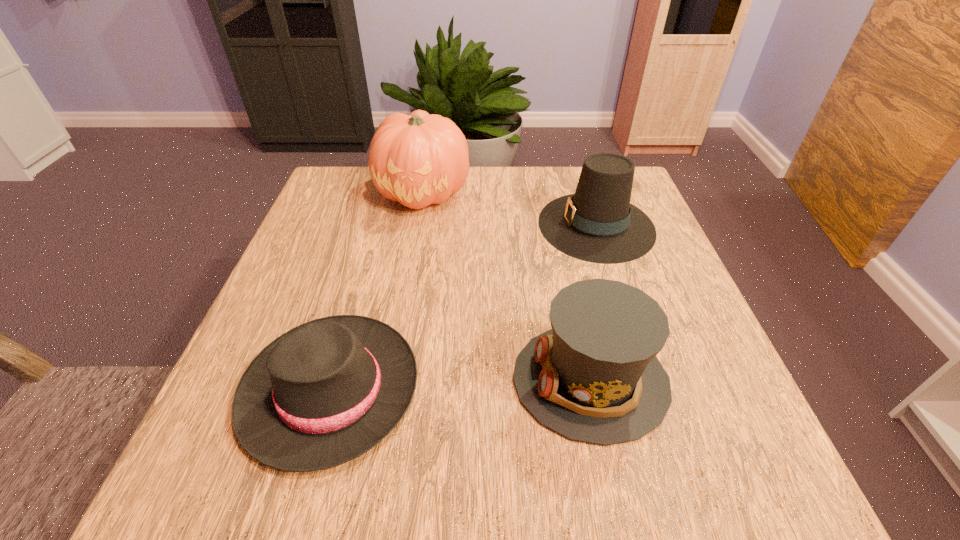
The height and width of the screenshot is (540, 960). I want to click on the tallest object, so click(x=419, y=159).

The height and width of the screenshot is (540, 960). Identify the location of the farthest dress hat. (598, 224).

I want to click on the shortest object, so click(325, 392).

Where is `the shortest dress hat`? This screenshot has height=540, width=960. the shortest dress hat is located at coordinates (325, 392).

This screenshot has width=960, height=540. What are the coordinates of `free space located 0.140m on the carved face of the pumpkin` in the screenshot? It's located at (412, 259).

Image resolution: width=960 pixels, height=540 pixels. Identify the location of vacant space located 0.120m on the front-facing side of the farthest dress hat. (488, 225).

Image resolution: width=960 pixels, height=540 pixels. I want to click on vacant space located 0.340m on the front-facing side of the farthest dress hat, so click(x=396, y=225).

What are the coordinates of `free space located on the front-facing side of the farthest dress hat` in the screenshot? It's located at (408, 225).

Find the location of a particular element. Image resolution: width=960 pixels, height=540 pixels. vacant area located on the right of the shortest object is located at coordinates (639, 389).

The image size is (960, 540). Identify the location of pumpkin that is at the far edge. (419, 159).